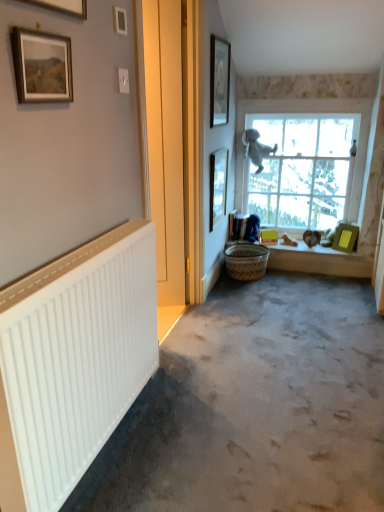
This screenshot has width=384, height=512. Find the location of `vacant area located to the right-hand side of woven brown basket at lower center`. vacant area located to the right-hand side of woven brown basket at lower center is located at coordinates (285, 281).